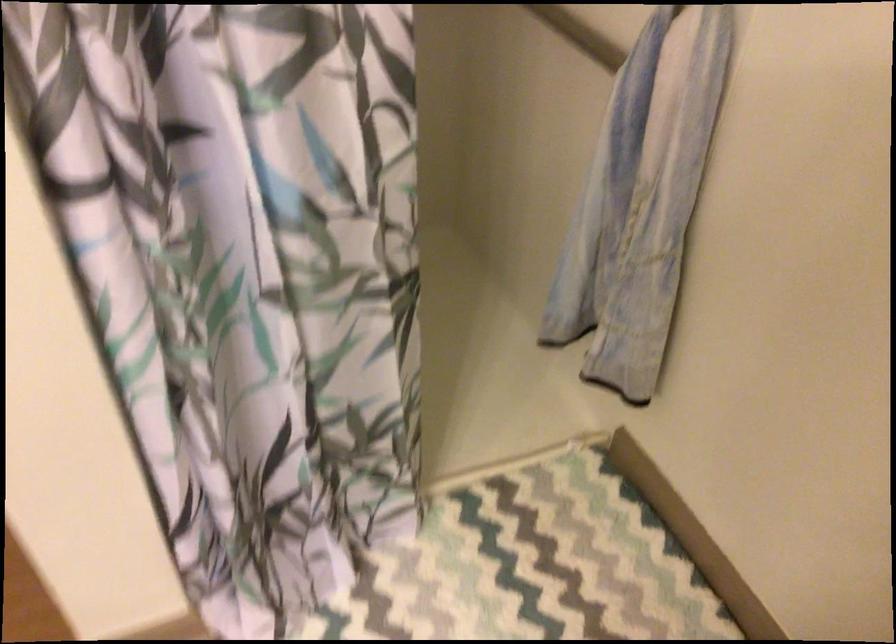
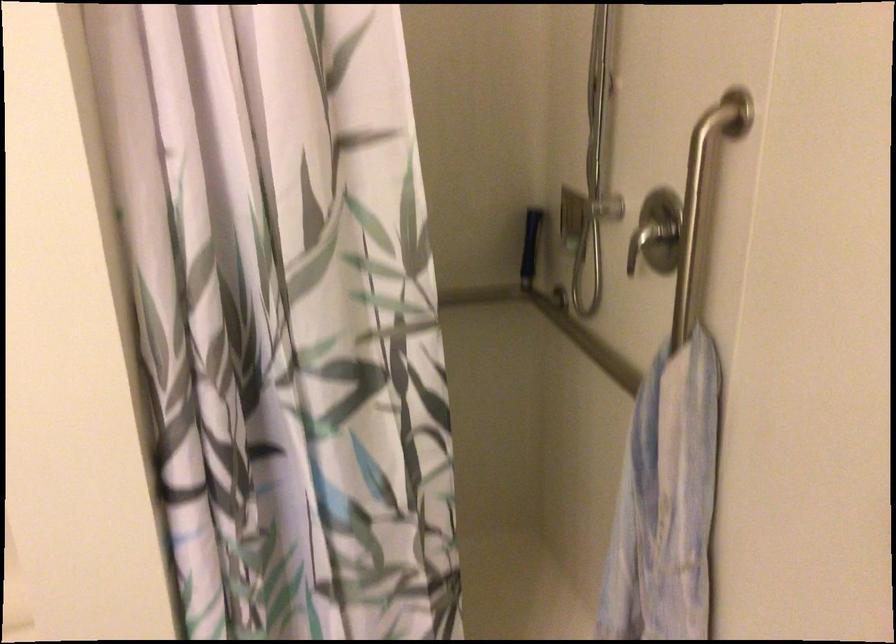
Which direction would the cameraman need to move to produce the second image?

The cameraman walked toward right, backward.